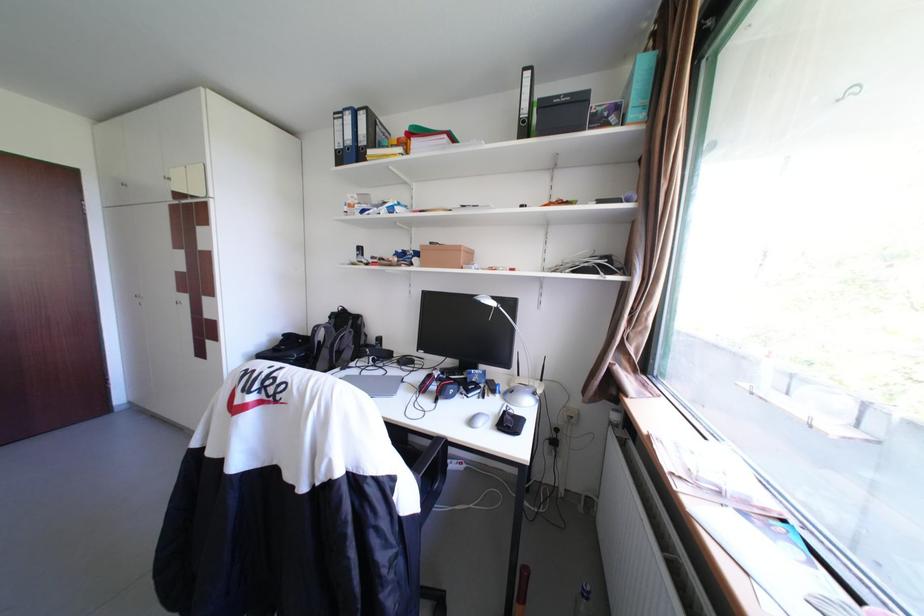
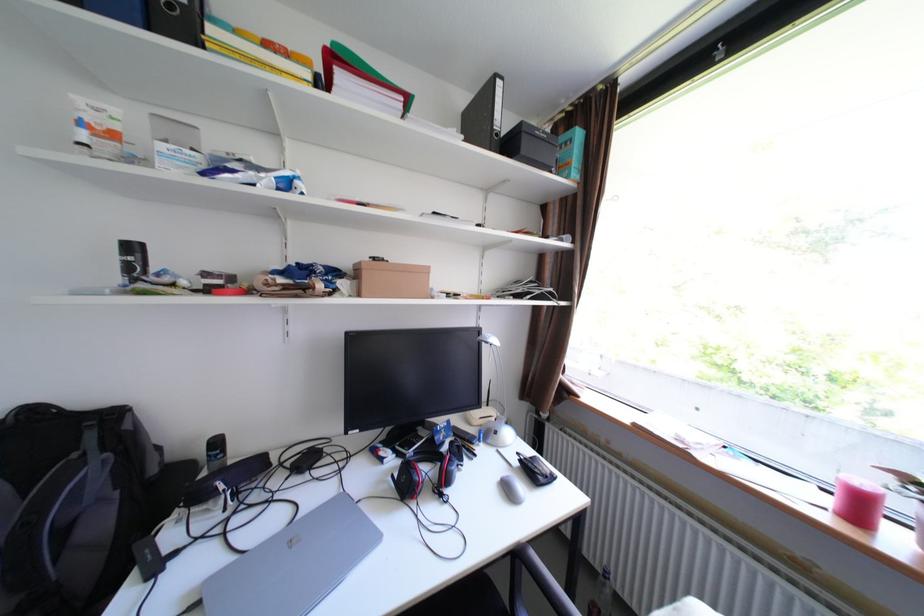
Question: The camera is either moving clockwise (left) or counter-clockwise (right) around the object. The first image is from the beginning of the video and the second image is from the end. Is the camera moving left or right when shooting the video?

Choices:
 (A) Left
 (B) Right

Answer: (A)